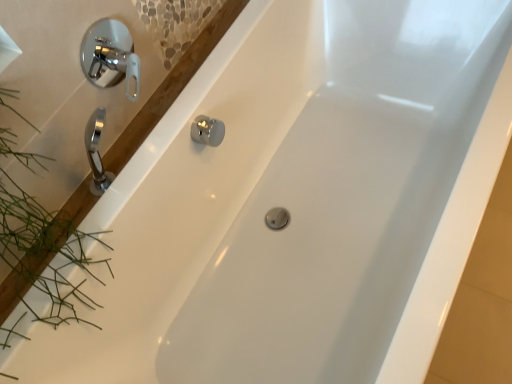
I want to click on chrome/metallic shower handle at upper left, so click(110, 56).

Image resolution: width=512 pixels, height=384 pixels. Describe the element at coordinates (110, 56) in the screenshot. I see `chrome/metallic shower handle at upper left` at that location.

Where is `chrome/metallic shower handle at upper left`? The width and height of the screenshot is (512, 384). chrome/metallic shower handle at upper left is located at coordinates (110, 56).